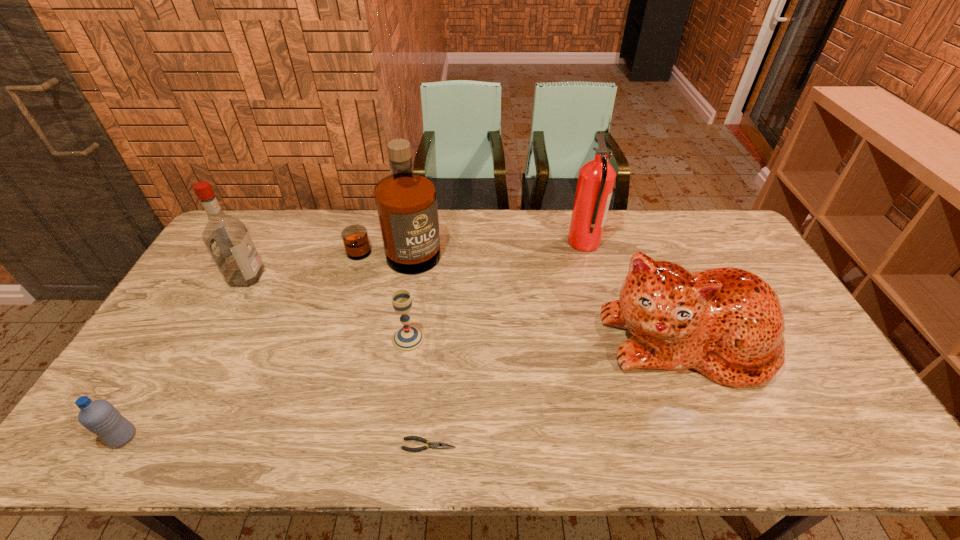
At what (x,y) coordinates should I click in order to perform the action: click on free space that satisfies the following two spatial constraints: 1. on the front label of the right liquor; 2. on the left side of the shortest object. Please return your answer as a coordinate pair (x, y). This screenshot has height=540, width=960. Looking at the image, I should click on (353, 445).

The image size is (960, 540). What are the coordinates of `free space that satisfies the following two spatial constraints: 1. on the front side of the chalice; 2. on the right side of the shortest object` in the screenshot? It's located at (393, 445).